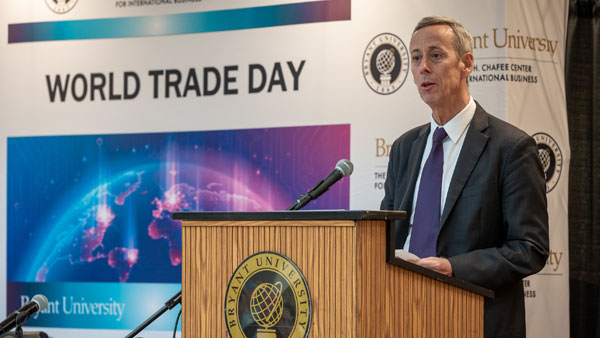
Where is `podium`? podium is located at coordinates (353, 299).